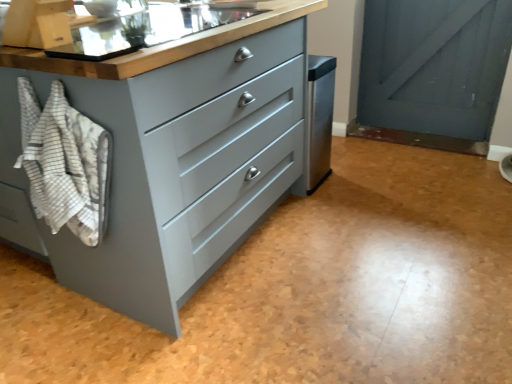
The image size is (512, 384). Describe the element at coordinates (64, 163) in the screenshot. I see `white striped towel at left` at that location.

What is the approximate width of matte stainless steel sink at upper center?

72.72 centimeters.

Locate an element on the screen. This screenshot has width=512, height=384. white striped towel at left is located at coordinates (64, 163).

From their relative heights in the image, would you say white striped towel at left is taller or shorter than matte stainless steel sink at upper center?

Clearly, white striped towel at left is taller compared to matte stainless steel sink at upper center.

Identify the location of blanket located underneath the matte stainless steel sink at upper center (from a real-world perspective). This screenshot has height=384, width=512. [64, 163].

From a real-world perspective, is white striped towel at left above or below matte stainless steel sink at upper center?

From a real-world perspective, white striped towel at left is physically below matte stainless steel sink at upper center.

In the scene shown: How many degrees apart are the facing directions of white striped towel at left and matte stainless steel sink at upper center?

They differ by 2.55 degrees in their facing directions.

Would you say matte stainless steel sink at upper center is inside or outside white striped towel at left?

→ matte stainless steel sink at upper center exists outside the volume of white striped towel at left.

Is matte stainless steel sink at upper center aimed at white striped towel at left?

No, matte stainless steel sink at upper center is not aimed at white striped towel at left.

Is matte stainless steel sink at upper center taller or shorter than white striped towel at left?

In the image, matte stainless steel sink at upper center appears to be shorter than white striped towel at left.

I want to click on blanket lying on the left of matte stainless steel sink at upper center, so click(64, 163).

Considering the relative sizes of matte stainless steel sink at upper center and matte gray chest of drawers at center in the image provided, is matte stainless steel sink at upper center shorter than matte gray chest of drawers at center?

Yes, matte stainless steel sink at upper center is shorter than matte gray chest of drawers at center.

Which is in front, point (136, 36) or point (164, 246)?

The point (164, 246) is in front.

From the picture: From the image's perspective, is matte stainless steel sink at upper center located above or below matte gray chest of drawers at center?

Based on their image positions, matte stainless steel sink at upper center is located above matte gray chest of drawers at center.

From a real-world perspective, is matte stainless steel sink at upper center positioned under matte gray chest of drawers at center based on gravity?

Incorrect, from a real-world perspective, matte stainless steel sink at upper center is higher than matte gray chest of drawers at center.

Considering the positions of objects white striped towel at left and matte gray chest of drawers at center in the image provided, who is behind, white striped towel at left or matte gray chest of drawers at center?

Positioned behind is white striped towel at left.

Which of these two, white striped towel at left or matte gray chest of drawers at center, is bigger?

Bigger between the two is matte gray chest of drawers at center.

Does point (22, 143) appear closer or farther from the camera than point (69, 64)?

Point (22, 143) is positioned farther from the camera compared to point (69, 64).

Is white striped towel at left not close to matte gray chest of drawers at center?

white striped towel at left is near matte gray chest of drawers at center, not far away.

Measure the distance from matte gray chest of drawers at center to matte stainless steel sink at upper center.

matte gray chest of drawers at center is 18.74 inches away from matte stainless steel sink at upper center.

Is matte gray chest of drawers at center facing away from matte stainless steel sink at upper center?

matte gray chest of drawers at center is not turned away from matte stainless steel sink at upper center.

Considering the sizes of objects matte gray chest of drawers at center and matte stainless steel sink at upper center in the image provided, who is thinner, matte gray chest of drawers at center or matte stainless steel sink at upper center?

matte gray chest of drawers at center.

Are matte gray chest of drawers at center and matte stainless steel sink at upper center far apart?

No, matte gray chest of drawers at center is not far away from matte stainless steel sink at upper center.

Which of these two, matte gray chest of drawers at center or white striped towel at left, stands shorter?

With less height is white striped towel at left.

Looking at this image, between matte gray chest of drawers at center and white striped towel at left, which one is positioned in front?

Positioned in front is matte gray chest of drawers at center.

Would you say white striped towel at left is part of matte gray chest of drawers at center's contents?

Yes, white striped towel at left is surrounded by matte gray chest of drawers at center.

Is point (202, 252) closer to viewer compared to point (79, 214)?

That is False.

At what (x,y) coordinates should I click in order to perform the action: click on blanket below the matte stainless steel sink at upper center (from a real-world perspective). Please return your answer as a coordinate pair (x, y). This screenshot has height=384, width=512. Looking at the image, I should click on (64, 163).

Where is `sink that is behind the white striped towel at left`? sink that is behind the white striped towel at left is located at coordinates (180, 20).

Based on their spatial positions, is matte gray chest of drawers at center or matte stainless steel sink at upper center closer to white striped towel at left?

matte gray chest of drawers at center is closer to white striped towel at left.

In the scene shown: Considering their positions, is matte stainless steel sink at upper center positioned closer to matte gray chest of drawers at center than white striped towel at left?

white striped towel at left lies closer to matte gray chest of drawers at center than the other object.

Looking at the image, which one is located further to matte stainless steel sink at upper center, matte gray chest of drawers at center or white striped towel at left?

white striped towel at left is positioned further to the anchor matte stainless steel sink at upper center.

When comparing their distances from matte gray chest of drawers at center, does white striped towel at left or matte stainless steel sink at upper center seem closer?

white striped towel at left is closer to matte gray chest of drawers at center.

From the image, which object appears to be nearer to white striped towel at left, matte stainless steel sink at upper center or matte gray chest of drawers at center?

The object closer to white striped towel at left is matte gray chest of drawers at center.

Based on their spatial positions, is white striped towel at left or matte gray chest of drawers at center closer to matte stainless steel sink at upper center?

matte gray chest of drawers at center.

Image resolution: width=512 pixels, height=384 pixels. What are the coordinates of `the chest of drawers that lies between matte stainless steel sink at upper center and white striped towel at left from top to bottom` in the screenshot? It's located at point(176,153).